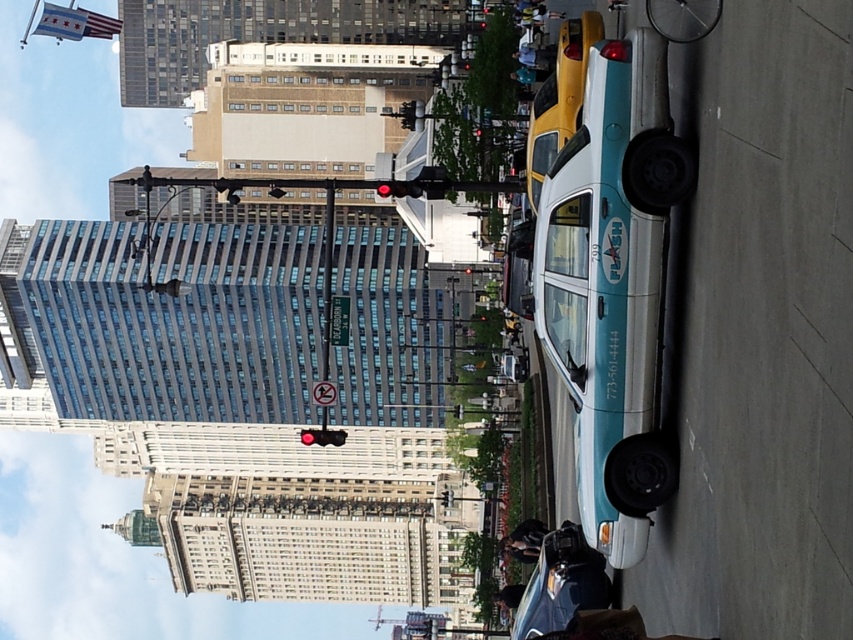
Question: Considering the relative positions of teal glossy taxi at center and teal glossy taxi at lower right in the image provided, where is teal glossy taxi at center located with respect to teal glossy taxi at lower right?

Choices:
 (A) above
 (B) below

Answer: (A)

Question: From the image, what is the correct spatial relationship of teal glossy taxi at center in relation to teal glossy taxi at lower right?

Choices:
 (A) right
 (B) left

Answer: (A)

Question: Which point appears closest to the camera in this image?

Choices:
 (A) (618, 198)
 (B) (554, 545)

Answer: (A)

Question: Among these objects, which one is farthest from the camera?

Choices:
 (A) teal glossy taxi at lower right
 (B) teal glossy taxi at center

Answer: (A)

Question: Can you confirm if teal glossy taxi at center is positioned below teal glossy taxi at lower right?

Choices:
 (A) yes
 (B) no

Answer: (B)